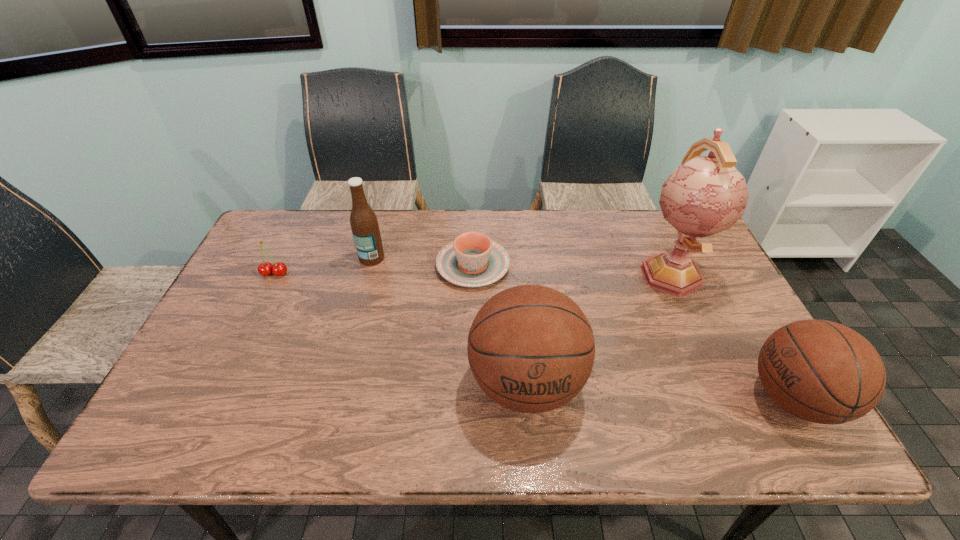
Where is `vacant place for an extra basketball on the left`? This screenshot has height=540, width=960. vacant place for an extra basketball on the left is located at coordinates (273, 368).